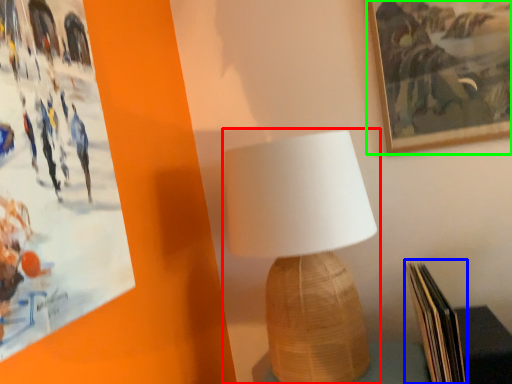
Question: Based on their relative distances, which object is nearer to lamp (highlighted by a red box)? Choose from paperback book (highlighted by a blue box) and picture frame (highlighted by a green box).

Choices:
 (A) paperback book
 (B) picture frame

Answer: (A)